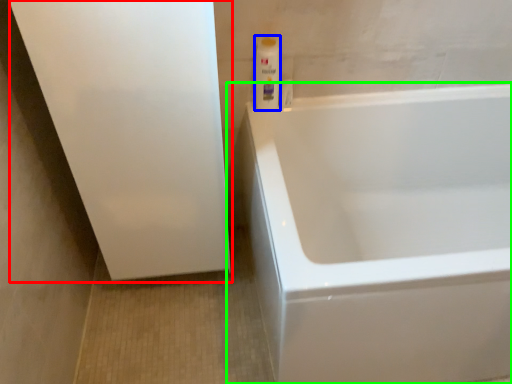
Question: Considering the real-world distances, which object is closest to screen door (highlighted by a red box)? cleaning product (highlighted by a blue box) or bathtub (highlighted by a green box).

Choices:
 (A) cleaning product
 (B) bathtub

Answer: (A)